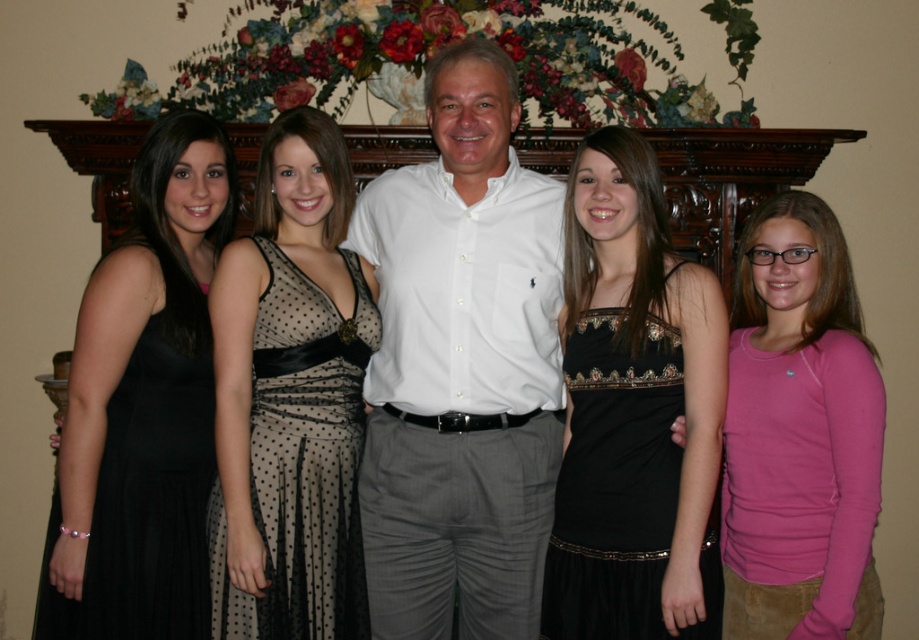
Which is above, white cotton shirt at center or black sheer polka dot dress at center?

Positioned higher is white cotton shirt at center.

Is the position of white cotton shirt at center less distant than that of black sheer polka dot dress at center?

No.

The width and height of the screenshot is (919, 640). In order to click on white cotton shirt at center in this screenshot , I will do `click(461, 368)`.

Which is more to the left, pink jersey at right or black sheer polka dot dress at center?

black sheer polka dot dress at center

Does pink jersey at right appear over black sheer polka dot dress at center?

Indeed, pink jersey at right is positioned over black sheer polka dot dress at center.

Which is behind, point (746, 408) or point (259, 618)?

Point (746, 408)

Find the location of a particular element. pink jersey at right is located at coordinates click(x=800, y=435).

Does point (766, 620) come behind point (671, 538)?

That is False.

Which is in front, point (749, 496) or point (587, 547)?

Positioned in front is point (749, 496).

Find the location of `pink jersey at right`. pink jersey at right is located at coordinates (800, 435).